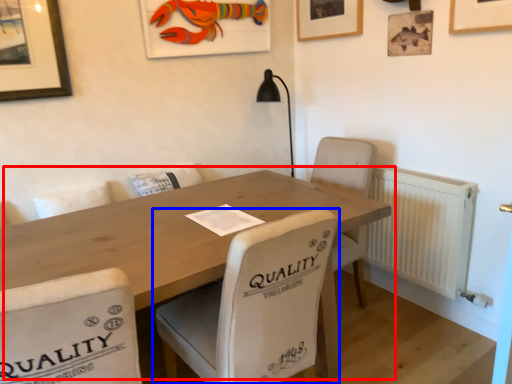
Question: Which point is further to the camera, table (highlighted by a red box) or chair (highlighted by a blue box)?

Choices:
 (A) table
 (B) chair

Answer: (B)